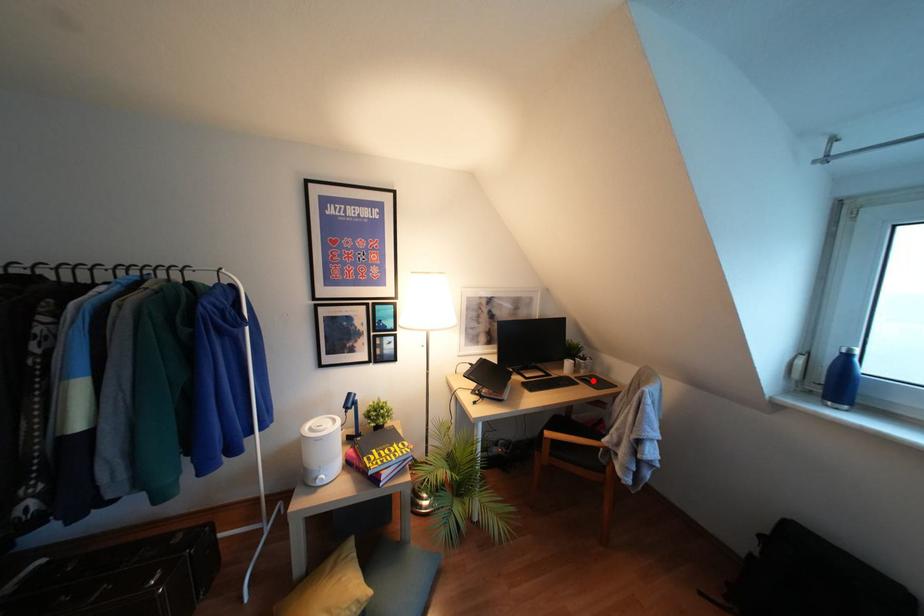
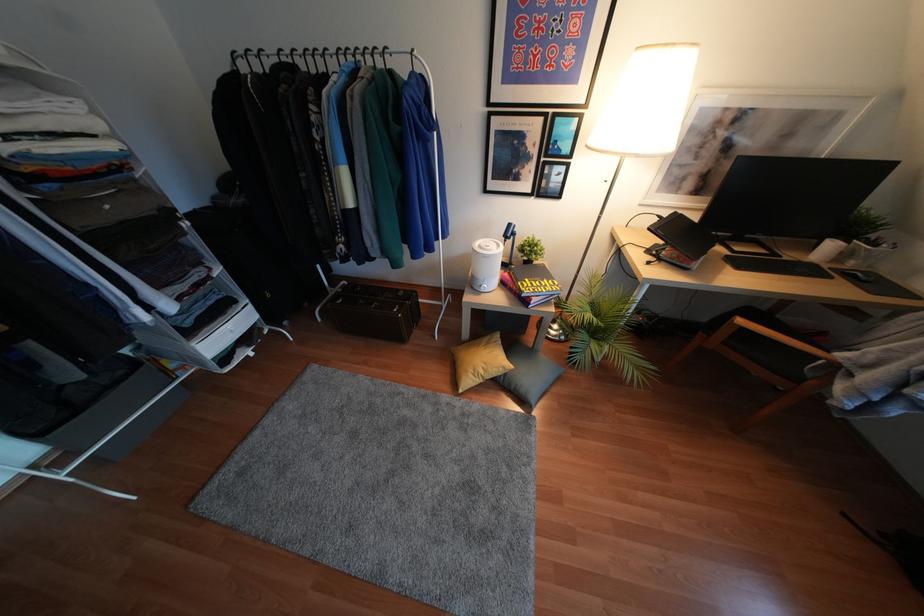
Find the pixel in the second image that matches the highlighted location in the first image.

(868, 281)